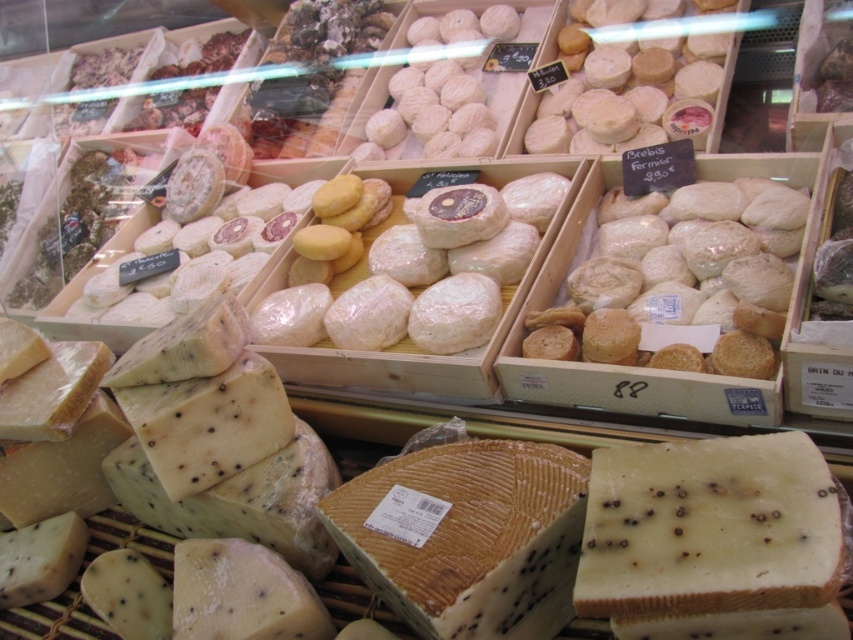
Does white crumbly cheese at center have a lesser height compared to white crumbly bread at center?

Yes.

Between point (633, 496) and point (715, 284), which one is positioned behind?

Positioned behind is point (715, 284).

Which is behind, point (753, 566) or point (703, 317)?

Point (703, 317)

Locate an element on the screen. This screenshot has width=853, height=640. white crumbly cheese at center is located at coordinates (709, 528).

Between white crumbly cheese at center and blue veined cheese at center, which one appears on the left side from the viewer's perspective?

Positioned to the left is blue veined cheese at center.

Who is shorter, white crumbly cheese at center or blue veined cheese at center?

white crumbly cheese at center is shorter.

Is point (616, 454) farther from viewer compared to point (376, 552)?

No, (616, 454) is in front of (376, 552).

At what (x,y) coordinates should I click in order to perform the action: click on white crumbly cheese at center. Please return your answer as a coordinate pair (x, y). The image size is (853, 640). Looking at the image, I should click on (709, 528).

Is the position of white crumbly bread at center more distant than that of blue veined cheese at center?

Yes, it is behind blue veined cheese at center.

Who is more distant from viewer, [706,308] or [408,579]?

The point [706,308] is behind.

Locate an element on the screen. white crumbly bread at center is located at coordinates (682, 282).